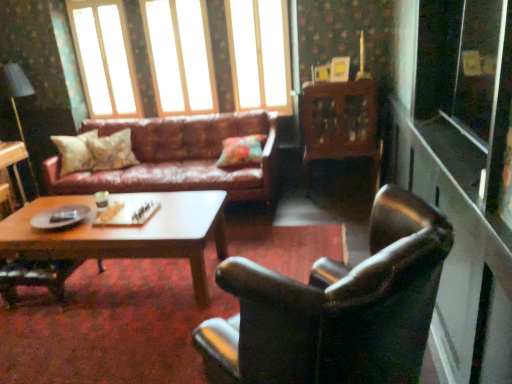
Question: Looking at the image, does wooden cabinet at center seem bigger or smaller compared to floral fabric pillow at center, the second pillow viewed from the right?

Choices:
 (A) big
 (B) small

Answer: (A)

Question: From the image's perspective, is wooden cabinet at center located above or below floral fabric pillow at center, the second pillow viewed from the right?

Choices:
 (A) below
 (B) above

Answer: (B)

Question: Estimate the real-world distances between objects in this image. Which object is closer to the clear glass window at upper center, the first window positioned from the left?

Choices:
 (A) transparent glass window at upper center, which appears as the second window when viewed from the right
 (B) white glossy coffee cup at center
 (C) wooden glossy coffee table at center
 (D) leather armchair at right
 (E) fluffy beige pillow at center, the first pillow positioned from the left

Answer: (A)

Question: Based on their relative distances, which object is nearer to the translucent glass window at upper center, which ranks as the third window in left-to-right order?

Choices:
 (A) wooden glossy coffee table at center
 (B) fluffy beige pillow at center, the first pillow positioned from the left
 (C) clear glass window at upper center, the first window positioned from the left
 (D) leather armchair at right
 (E) matte black lampshade at upper left

Answer: (C)